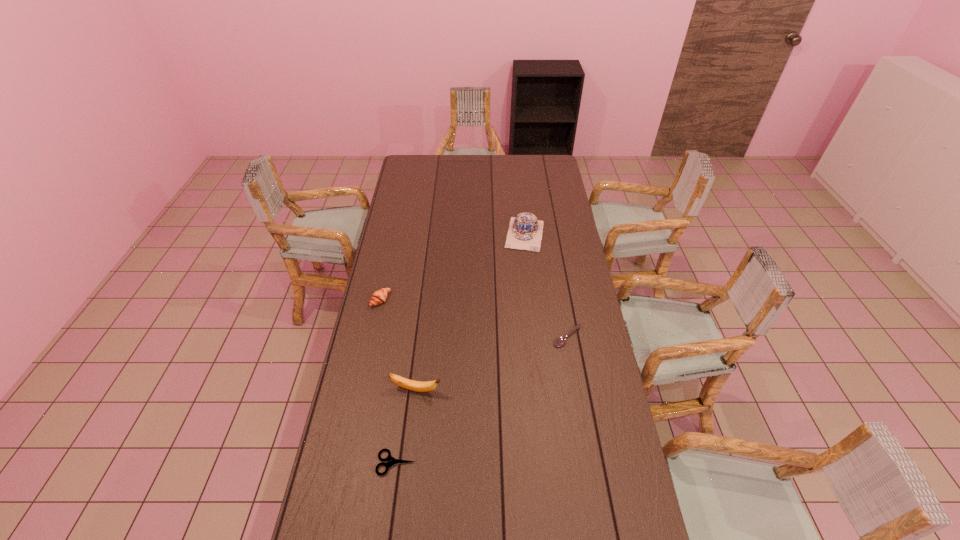
Identify the location of the nearest object. The image size is (960, 540). (391, 460).

Locate an element on the screen. The image size is (960, 540). the shortest object is located at coordinates (391, 460).

Find the location of a particular element. The width and height of the screenshot is (960, 540). the second shortest object is located at coordinates (560, 341).

Identify the location of soupspoon. The width and height of the screenshot is (960, 540). (560, 341).

At what (x,y) coordinates should I click in order to perform the action: click on banana. Please return your answer as a coordinate pair (x, y). Image resolution: width=960 pixels, height=540 pixels. Looking at the image, I should click on (418, 386).

Where is `cap`? cap is located at coordinates (525, 232).

Identify the location of pastry. The height and width of the screenshot is (540, 960). point(380,296).

At what (x,y) coordinates should I click in order to perform the action: click on the third shortest object. Please return your answer as a coordinate pair (x, y). This screenshot has width=960, height=540. Looking at the image, I should click on (380, 296).

Identify the location of free space located on the back of the shears. This screenshot has width=960, height=540. (406, 392).

Find the location of a particular element. Image resolution: width=960 pixels, height=540 pixels. vacant point located on the front of the third nearest object is located at coordinates (572, 364).